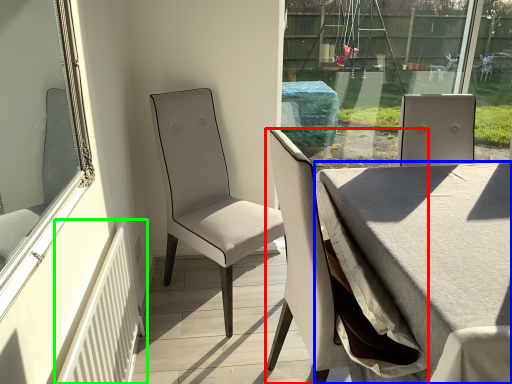
Question: Estimate the real-world distances between objects in this image. Which object is farther from chair (highlighted by a red box), table (highlighted by a blue box) or radiator (highlighted by a green box)?

Choices:
 (A) table
 (B) radiator

Answer: (B)